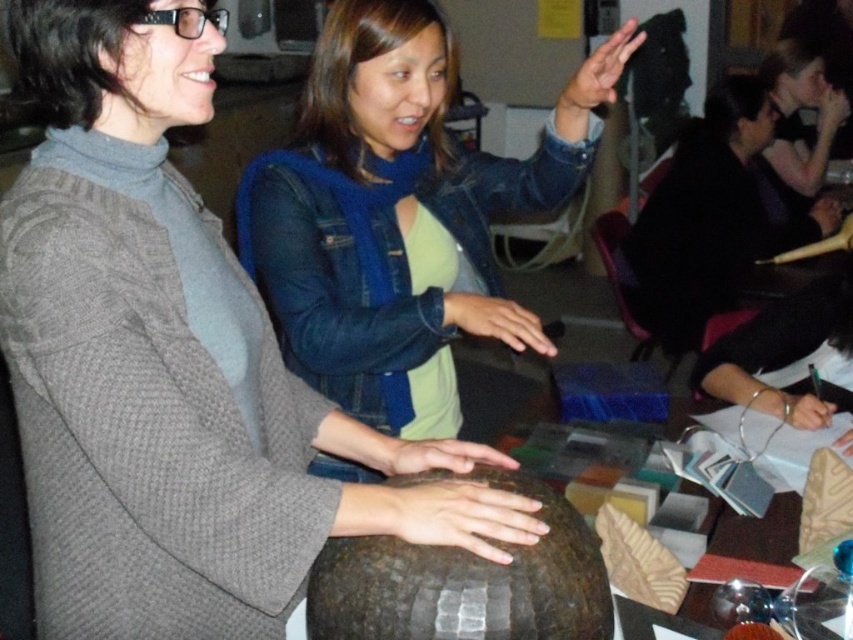
Between matte brown sphere at center and denim jacket at center, which one is positioned lower?

matte brown sphere at center

Who is more forward, (x=80, y=230) or (x=287, y=316)?

Positioned in front is point (x=80, y=230).

This screenshot has width=853, height=640. What do you see at coordinates (172, 364) in the screenshot?
I see `matte brown sphere at center` at bounding box center [172, 364].

Locate an element on the screen. The height and width of the screenshot is (640, 853). matte brown sphere at center is located at coordinates (172, 364).

Who is more distant from viewer, (450,266) or (785,150)?

Positioned behind is point (785,150).

Can you confirm if denim jacket at center is positioned above matte black hair at upper right?

No, denim jacket at center is not above matte black hair at upper right.

Find the location of `denim jacket at center`. denim jacket at center is located at coordinates (399, 216).

Locate an element on the screen. This screenshot has height=640, width=853. denim jacket at center is located at coordinates (399, 216).

From the picture: How much distance is there between matte brown sphere at center and matte black hair at upper right?

A distance of 2.86 meters exists between matte brown sphere at center and matte black hair at upper right.

Who is more forward, [108,320] or [784,72]?

Point [108,320] is in front.

Between point (80, 301) and point (819, 106), which one is positioned behind?

Positioned behind is point (819, 106).

Locate an element on the screen. matte brown sphere at center is located at coordinates (172, 364).